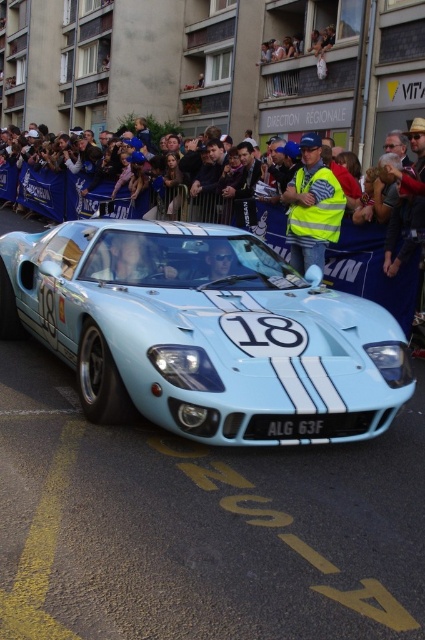
How much distance is there between light blue metallic sports car at center and yellow reflective vest at center?

3.22 meters

Can you confirm if light blue metallic sports car at center is smaller than yellow reflective vest at center?

Actually, light blue metallic sports car at center might be larger than yellow reflective vest at center.

Is point (246, 412) in front of point (292, 250)?

Yes, point (246, 412) is in front of point (292, 250).

In order to click on light blue metallic sports car at center in this screenshot , I will do `click(198, 326)`.

Consider the image. Between yellow reflective vest at center and black plastic license plate at center, which one appears on the left side from the viewer's perspective?

Positioned to the left is black plastic license plate at center.

This screenshot has height=640, width=425. Find the location of `yellow reflective vest at center`. yellow reflective vest at center is located at coordinates (312, 205).

At what (x,y) coordinates should I click in order to perform the action: click on light blue metallic sports car at center. Please return your answer as a coordinate pair (x, y). The image size is (425, 640). Looking at the image, I should click on (198, 326).

Is the position of light blue metallic sports car at center less distant than that of black plastic license plate at center?

Yes, it is in front of black plastic license plate at center.

Who is more distant from viewer, (180, 289) or (345, 433)?

Result: Point (180, 289)

Find the location of a particular element. light blue metallic sports car at center is located at coordinates (198, 326).